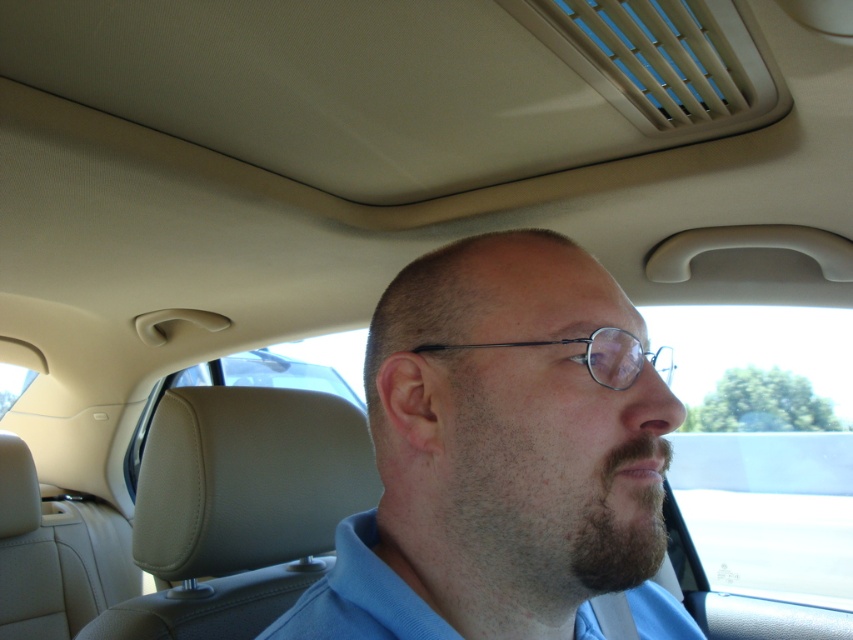
You are a tailor measuring the distance between two shirts in a car. The blue fabric shirt at center is on the driver and the blue cotton shirt at center is on the passenger seat. Can you fit a 2.5 inch wide measuring tape between them?

The distance between the blue fabric shirt at center and the blue cotton shirt at center is 2.69 inches, so yes, the 2.5 inch wide measuring tape can fit between them since the gap is wider than the tape.

You are a fashion designer observing a person wearing two shirts in a car. Which shirt, the blue fabric shirt at center or the blue cotton shirt at center, is positioned to the left?

The blue fabric shirt at center is positioned to the left of the blue cotton shirt at center.

You are a photographer trying to capture a clear photo of the blue fabric shirt at center. You have a camera that requires a minimum distance of 20 inches to focus properly. Can you take the photo without moving the camera or the shirt?

The blue fabric shirt at center and camera are 19.08 inches apart from each other, which is less than the required 20 inches for proper focus. Therefore, you cannot take the photo without moving the camera or the shirt.